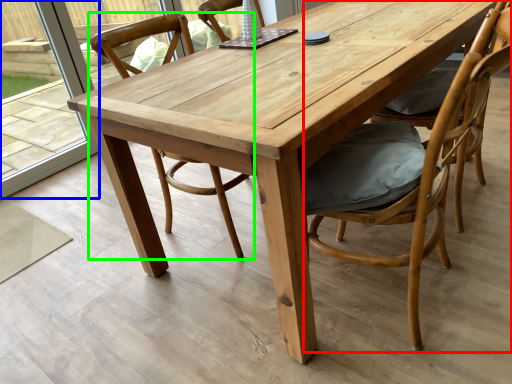
Question: Which is farther away from chair (highlighted by a red box)? glass door (highlighted by a blue box) or chair (highlighted by a green box)?

Choices:
 (A) glass door
 (B) chair

Answer: (A)